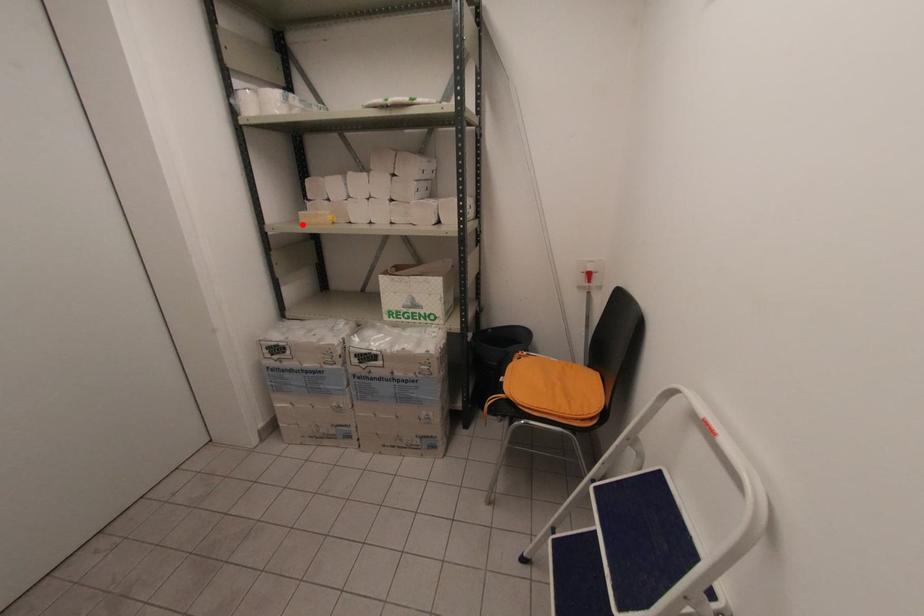
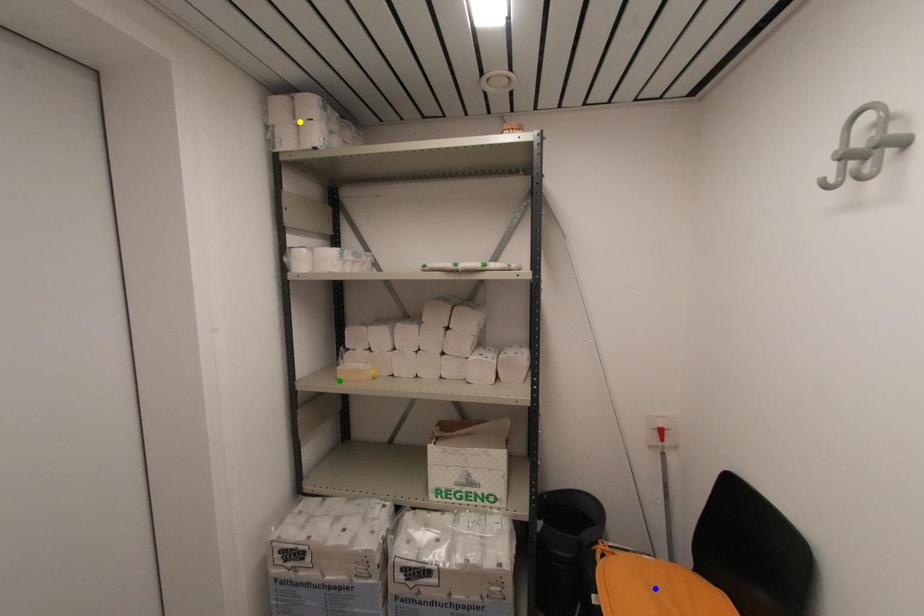
Question: I am providing you with two images of the same scene from different viewpoints. A red point is marked on the first image. You are given multiple points on the second image. Which mark in image 2 goes with the point in image 1?

Choices:
 (A) yellow point
 (B) green point
 (C) blue point

Answer: (B)